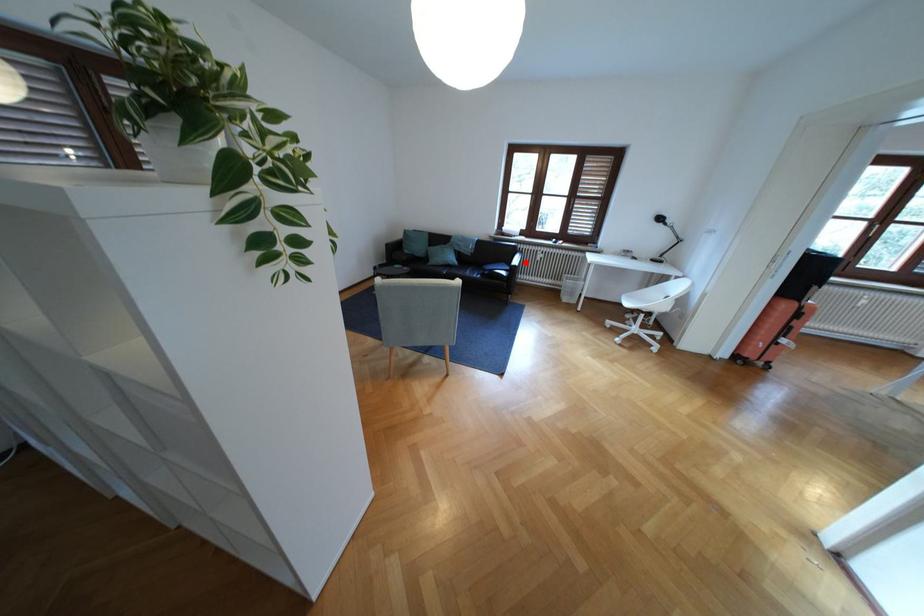
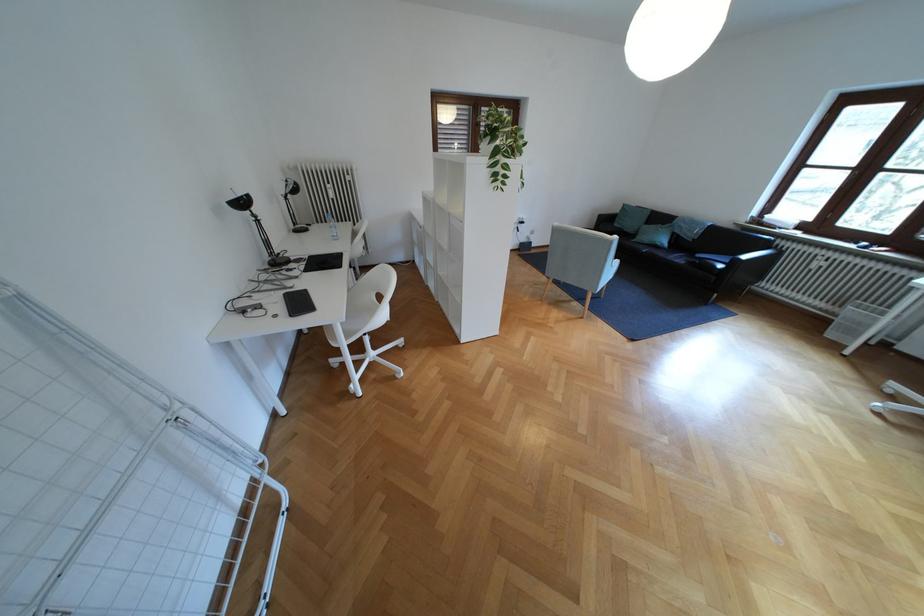
Where in the second image is the point corresponding to the highlighted location from the first image?

(757, 257)